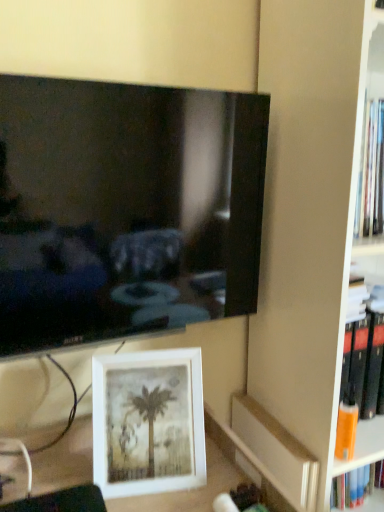
Question: Based on their sizes in the image, would you say black glossy tv at upper left is bigger or smaller than orange matte paperback book at lower right?

Choices:
 (A) small
 (B) big

Answer: (B)

Question: Which is correct: black glossy tv at upper left is inside orange matte paperback book at lower right, or outside of it?

Choices:
 (A) inside
 (B) outside

Answer: (B)

Question: Considering the real-world distances, which object is farthest from the white matte picture frame at lower center?

Choices:
 (A) orange matte paperback book at lower right
 (B) black glossy tv at upper left
 (C) matte black bookshelf at right

Answer: (C)

Question: Which is nearer to the orange matte paperback book at lower right?

Choices:
 (A) white matte picture frame at lower center
 (B) matte black bookshelf at right
 (C) black glossy tv at upper left

Answer: (B)